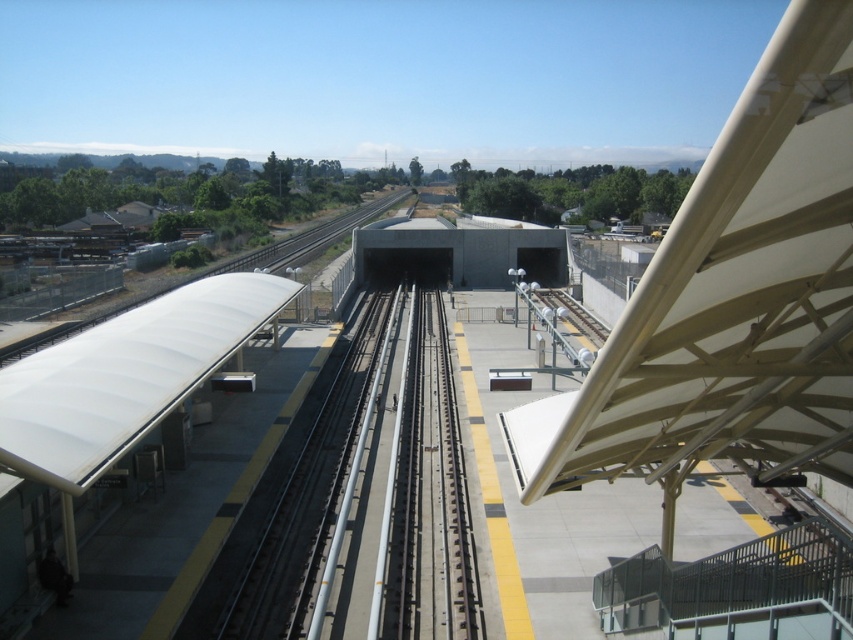
Question: Is metal/smooth train track at center positioned at the back of white matte platform at center?

Choices:
 (A) yes
 (B) no

Answer: (A)

Question: Which point is farther to the camera?

Choices:
 (A) (399, 568)
 (B) (314, 481)

Answer: (B)

Question: Which object appears closest to the camera in this image?

Choices:
 (A) white matte platform at center
 (B) metal/smooth train track at center

Answer: (A)

Question: Is the position of metal/smooth train track at center more distant than that of white matte platform at center?

Choices:
 (A) yes
 (B) no

Answer: (A)

Question: Does metal/smooth train track at center have a greater width compared to white matte platform at center?

Choices:
 (A) no
 (B) yes

Answer: (A)